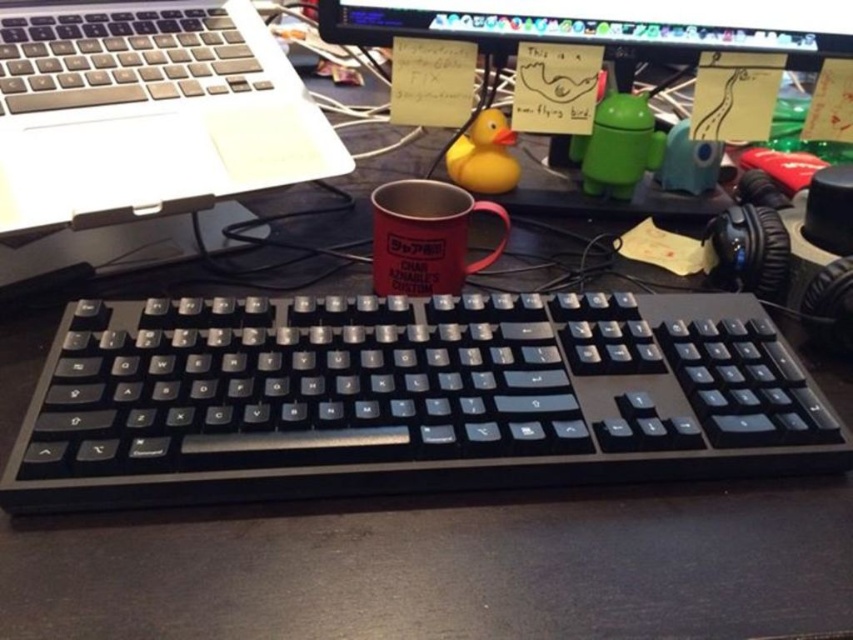
You are a remote worker who needs to access your email. You see the silver metallic laptop at upper left at point 0.172, 0.172. Can you reach it from your current position at point (146,109)?

The silver metallic laptop at upper left is located at point (146,109), so yes, you can reach it from your current position at point (146,109) since you are already at the same location.

You are setting up a new monitor and want to place it between the silver metallic laptop at upper left and the matte plastic monitor at upper center. However, you need to ensure that the new monitor won

The silver metallic laptop at upper left is much taller than the matte plastic monitor at upper center, so placing a new monitor between them may cause an uneven arrangement due to the height difference between the two existing devices.

You are organizing items on your desk and want to place a new item between the silver metallic laptop at upper left and the matte red mug at center. Based on their positions, where should you place the new item?

The silver metallic laptop at upper left is located above the matte red mug at center, so you should place the new item between them in the space below the laptop and above the mug.